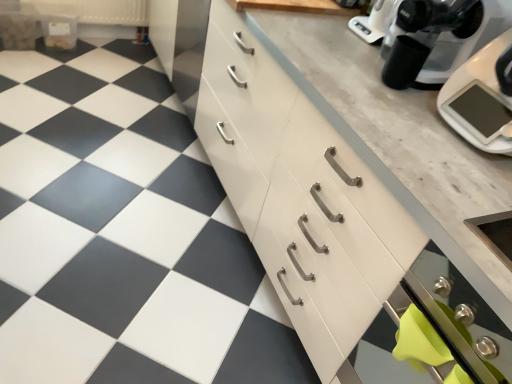
Question: Does white wood cabinet at center, the second cabinetry from the top, have a lesser height compared to white glossy tile at center?

Choices:
 (A) no
 (B) yes

Answer: (A)

Question: Is white wood cabinet at center, the 2th cabinetry from the back, oriented towards white glossy tile at center?

Choices:
 (A) no
 (B) yes

Answer: (B)

Question: Is white wood cabinet at center, positioned as the 1th cabinetry in bottom-to-top order, at the right side of white glossy tile at center?

Choices:
 (A) no
 (B) yes

Answer: (B)

Question: Is white wood cabinet at center, positioned as the 1th cabinetry in bottom-to-top order, at the left side of white glossy tile at center?

Choices:
 (A) no
 (B) yes

Answer: (A)

Question: Is white wood cabinet at center, positioned as the 1th cabinetry in bottom-to-top order, not within white glossy tile at center?

Choices:
 (A) yes
 (B) no

Answer: (A)

Question: From a real-world perspective, is white glossy tile at center physically located above or below white glossy cabinet at upper right, which is the 2th cabinetry from bottom to top?

Choices:
 (A) above
 (B) below

Answer: (B)

Question: Based on their positions, is white glossy tile at center located to the left or right of white glossy cabinet at upper right, placed as the 1th cabinetry when sorted from top to bottom?

Choices:
 (A) left
 (B) right

Answer: (A)

Question: Is white glossy tile at center inside the boundaries of white glossy cabinet at upper right, placed as the 1th cabinetry when sorted from top to bottom, or outside?

Choices:
 (A) inside
 (B) outside

Answer: (B)

Question: Based on their sizes in the image, would you say white glossy tile at center is bigger or smaller than white glossy cabinet at upper right, acting as the 2th cabinetry starting from the front?

Choices:
 (A) small
 (B) big

Answer: (A)

Question: Does point (450, 31) appear closer or farther from the camera than point (476, 87)?

Choices:
 (A) farther
 (B) closer

Answer: (A)

Question: In terms of size, does black plastic coffee maker at upper right appear bigger or smaller than white glossy kitchen scale at upper right?

Choices:
 (A) big
 (B) small

Answer: (B)

Question: Visually, is black plastic coffee maker at upper right positioned to the left or to the right of white glossy kitchen scale at upper right?

Choices:
 (A) left
 (B) right

Answer: (A)

Question: From the image's perspective, is black plastic coffee maker at upper right positioned above or below white glossy kitchen scale at upper right?

Choices:
 (A) above
 (B) below

Answer: (A)

Question: From the image's perspective, is white glossy kitchen scale at upper right positioned above or below stainless steel oven at lower right?

Choices:
 (A) below
 (B) above

Answer: (B)

Question: Considering the positions of point (507, 56) and point (368, 380), is point (507, 56) closer or farther from the camera than point (368, 380)?

Choices:
 (A) farther
 (B) closer

Answer: (B)